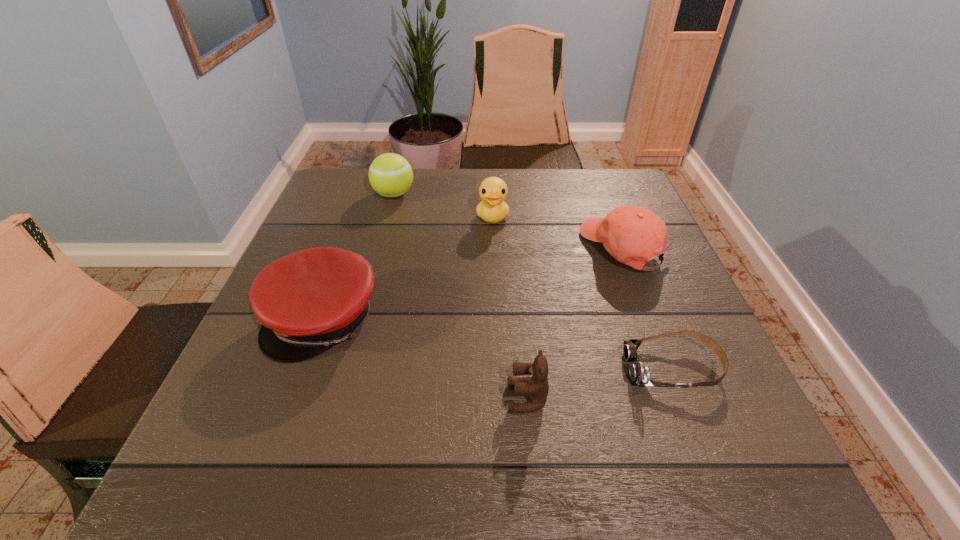
Identify the location of vacant space located on the face of the teddy bear. (319, 398).

You are a GUI agent. You are given a task and a screenshot of the screen. Output one action in this format:
    pyautogui.click(x=<x>, y=<y>)
    Task: Click on the vacant area located on the face of the teddy bear
    This screenshot has height=540, width=960.
    Given the screenshot: What is the action you would take?
    pyautogui.click(x=401, y=398)

At what (x,y) coordinates should I click in order to perform the action: click on free space located on the face of the teddy bear. Please return your answer as a coordinate pair (x, y). Looking at the image, I should click on (401, 398).

Locate an element on the screen. free location located on the front-facing side of the shortest object is located at coordinates (505, 368).

The image size is (960, 540). What are the coordinates of `vacant point located on the front-facing side of the shortest object` in the screenshot? It's located at (533, 368).

The height and width of the screenshot is (540, 960). I want to click on vacant space positioned 0.200m on the front-facing side of the shortest object, so click(516, 368).

You are a GUI agent. You are given a task and a screenshot of the screen. Output one action in this format:
    pyautogui.click(x=<x>, y=<y>)
    Task: Click on the tennis ball present at the far edge
    This screenshot has width=960, height=540.
    Given the screenshot: What is the action you would take?
    pyautogui.click(x=390, y=175)

Identify the location of duck at the far edge. (492, 209).

Where is `tennis ball that is positioned at the left edge`? The image size is (960, 540). tennis ball that is positioned at the left edge is located at coordinates (390, 175).

Where is `cap present at the left edge`? cap present at the left edge is located at coordinates (308, 301).